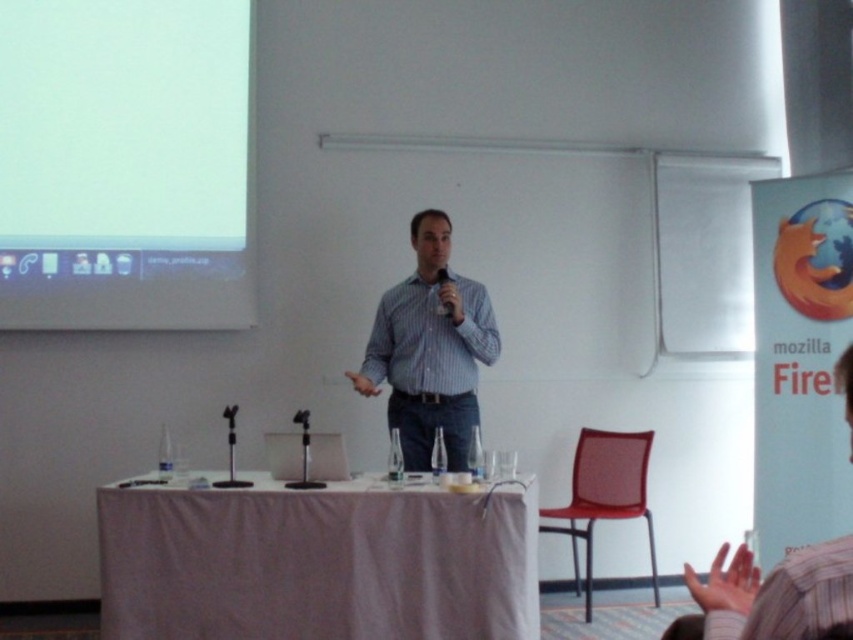
You are a technician adjusting the equipment for the presentation. You need to move the black plastic microphone at center closer to the red mesh chair at lower right by 0.5 meters. Is this possible without moving the table?

The red mesh chair at lower right is currently 1.53 meters away from the black plastic microphone at center. Moving the microphone closer by 0.5 meters would require reducing the distance to 1.03 meters. Since the table is between them, moving the microphone might be possible if there is enough space on the table to reposition it without obstructing other items like the laptop or the other microphones. However, the feasibility depends on the table layout and available space, which isn

You are organizing a small conference and need to place a 1.5 meter wide banner between the red mesh chair at lower right and the black plastic microphone at center. Will the banner fit in the space between them?

The red mesh chair at lower right is larger than the black plastic microphone at center, so the space between them may be sufficient to accommodate the 1.5 meter wide banner. However, without exact measurements of the distance between the two objects, it is difficult to confirm if the banner will fit perfectly.